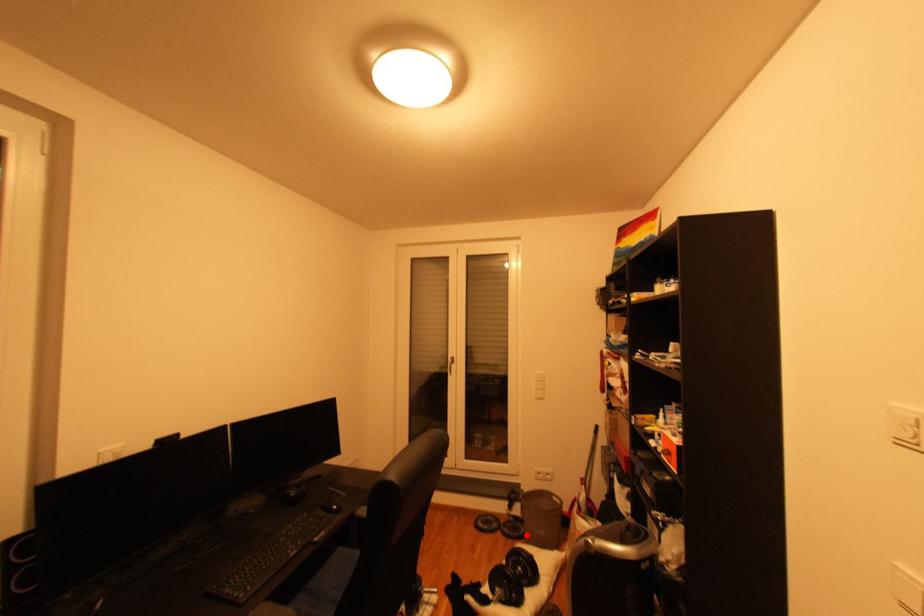
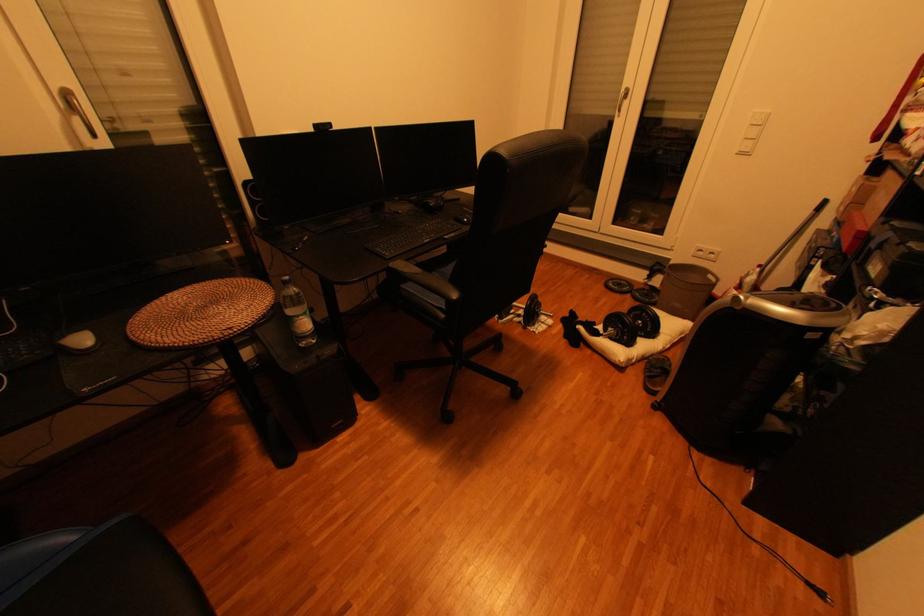
In the second image, find the point that corresponds to the highlighted location in the first image.

(658, 301)